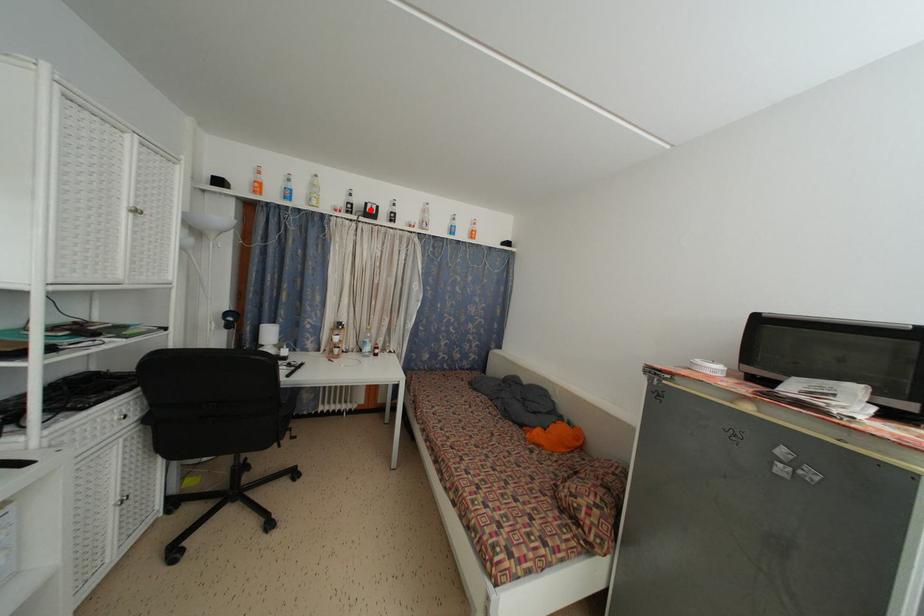
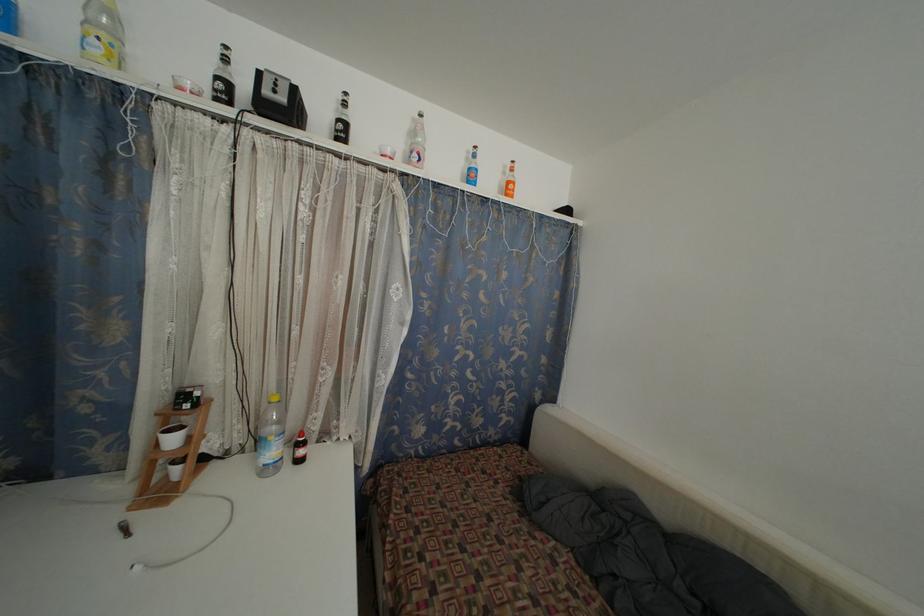
Find the pixel in the second image that matches the highlighted location in the first image.

(263, 79)